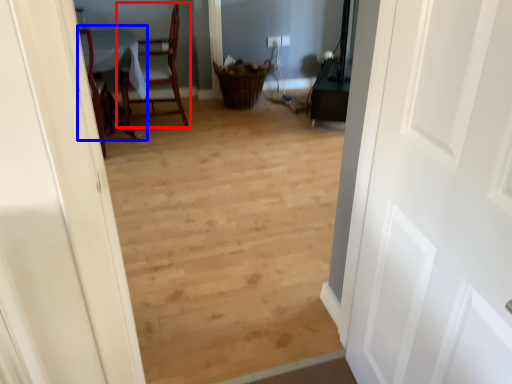
Question: Which object appears farthest to the camera in this image, chair (highlighted by a red box) or table (highlighted by a blue box)?

Choices:
 (A) chair
 (B) table

Answer: (A)